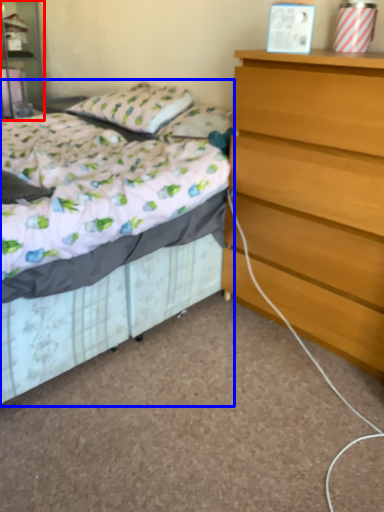
Question: Which point is closer to the camera, nightstand (highlighted by a red box) or bed (highlighted by a blue box)?

Choices:
 (A) nightstand
 (B) bed

Answer: (B)